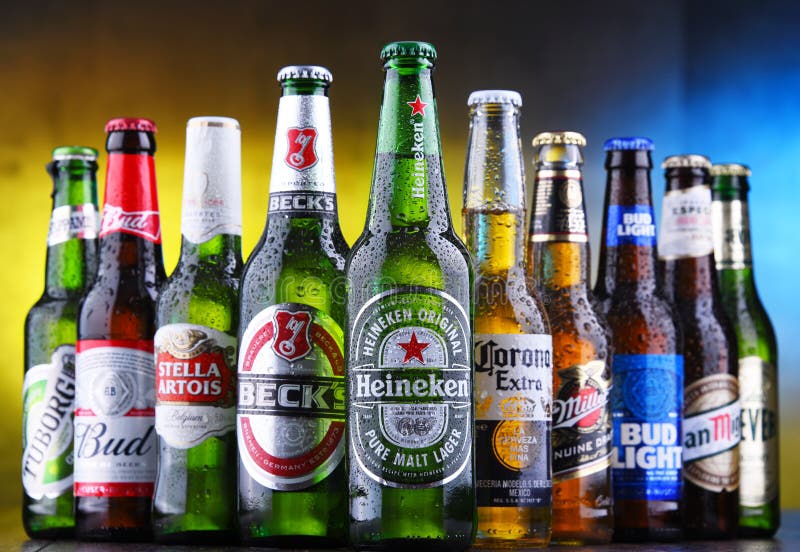
Where is `beer bottles`? Image resolution: width=800 pixels, height=552 pixels. beer bottles is located at coordinates (766, 427), (708, 429), (648, 423), (584, 419), (508, 411), (442, 391), (292, 402), (194, 387), (106, 417), (44, 450).